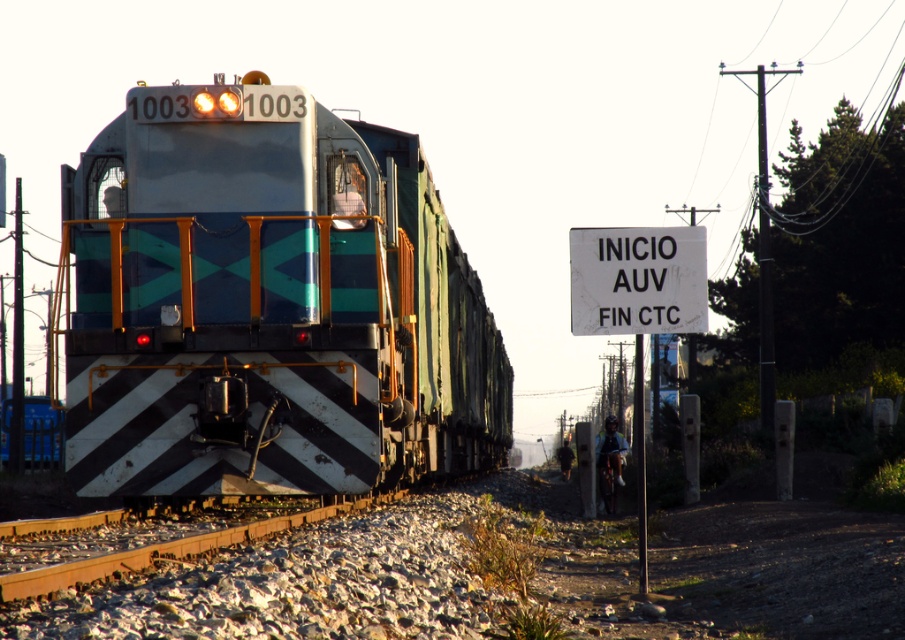
Question: Which of the following is the closest to the observer?

Choices:
 (A) white paper sign at center
 (B) metallic blue train at center

Answer: (B)

Question: Does white paper sign at center appear on the left side of white plastic sign at upper right?

Choices:
 (A) no
 (B) yes

Answer: (A)

Question: Which of the following is the farthest from the observer?

Choices:
 (A) pyautogui.click(x=642, y=244)
 (B) pyautogui.click(x=684, y=282)

Answer: (A)

Question: Which object appears closest to the camera in this image?

Choices:
 (A) white paper sign at center
 (B) metallic blue train at center

Answer: (B)

Question: Can you confirm if white paper sign at center is bigger than white plastic sign at upper right?

Choices:
 (A) yes
 (B) no

Answer: (A)

Question: Does white paper sign at center have a lesser width compared to white plastic sign at upper right?

Choices:
 (A) yes
 (B) no

Answer: (B)